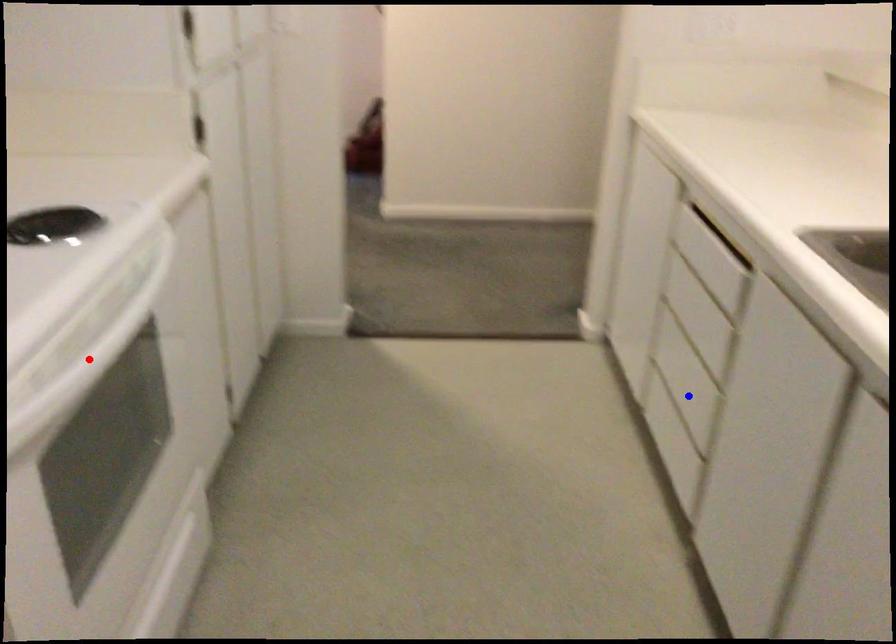
Question: Two points are marked on the image. Which point is closer to the camera?

Choices:
 (A) Blue point is closer.
 (B) Red point is closer.

Answer: (B)